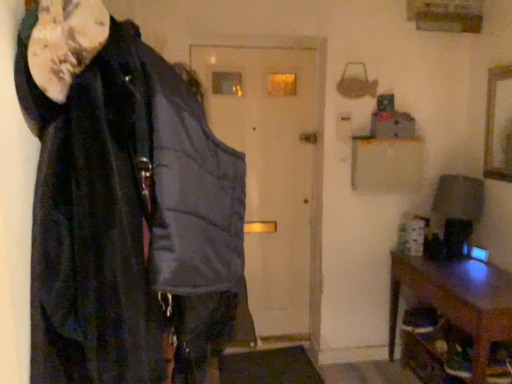
Question: Considering the relative sizes of wooden picture frame at upper right and matte gray vest at center in the image provided, is wooden picture frame at upper right wider than matte gray vest at center?

Choices:
 (A) yes
 (B) no

Answer: (B)

Question: Can you see wooden picture frame at upper right touching matte gray vest at center?

Choices:
 (A) yes
 (B) no

Answer: (B)

Question: Does wooden picture frame at upper right have a smaller size compared to matte gray vest at center?

Choices:
 (A) no
 (B) yes

Answer: (B)

Question: Does wooden picture frame at upper right appear on the right side of matte gray vest at center?

Choices:
 (A) yes
 (B) no

Answer: (A)

Question: Is wooden picture frame at upper right further to camera compared to matte gray vest at center?

Choices:
 (A) yes
 (B) no

Answer: (B)

Question: Does wooden picture frame at upper right have a larger size compared to matte gray vest at center?

Choices:
 (A) yes
 (B) no

Answer: (B)

Question: From the image's perspective, is brown wooden table at lower right above wooden picture frame at upper right?

Choices:
 (A) yes
 (B) no

Answer: (B)

Question: Is brown wooden table at lower right shorter than wooden picture frame at upper right?

Choices:
 (A) yes
 (B) no

Answer: (B)

Question: Is brown wooden table at lower right bigger than wooden picture frame at upper right?

Choices:
 (A) no
 (B) yes

Answer: (B)

Question: Is brown wooden table at lower right thinner than wooden picture frame at upper right?

Choices:
 (A) yes
 (B) no

Answer: (B)

Question: Can you confirm if brown wooden table at lower right is positioned to the left of wooden picture frame at upper right?

Choices:
 (A) yes
 (B) no

Answer: (A)

Question: From a real-world perspective, is brown wooden table at lower right over wooden picture frame at upper right?

Choices:
 (A) no
 (B) yes

Answer: (A)

Question: Would you say wooden picture frame at upper right is a long distance from brown wooden table at lower right?

Choices:
 (A) yes
 (B) no

Answer: (B)